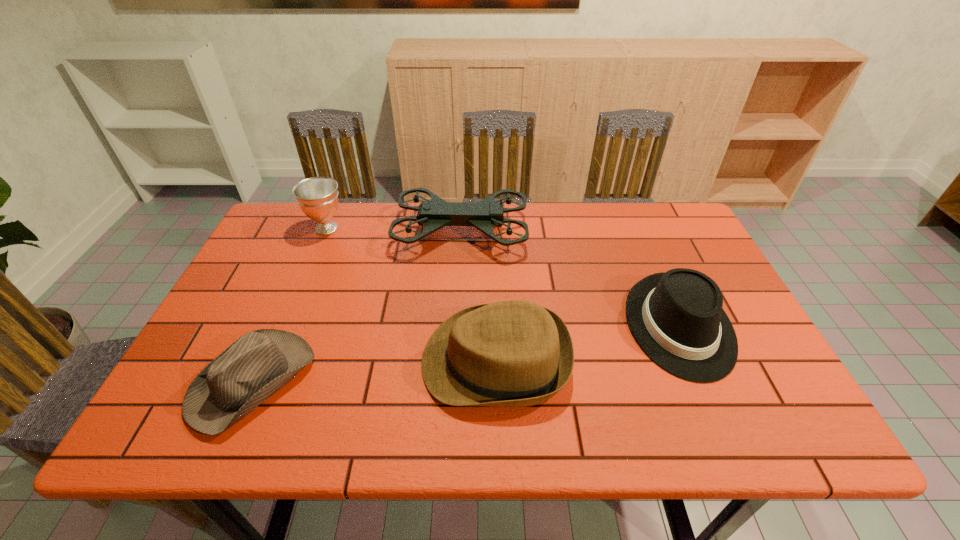
In the image, there is a desktop. Identify the location of blank space at the far edge. (627, 218).

Identify the location of blank space at the near edge of the desktop. This screenshot has height=540, width=960. (703, 410).

At what (x,y) coordinates should I click in order to perform the action: click on vacant space at the left edge of the desktop. Please return your answer as a coordinate pair (x, y). The image size is (960, 540). Looking at the image, I should click on (266, 298).

In the image, there is a desktop. At what (x,y) coordinates should I click in order to perform the action: click on free region at the right edge. Please return your answer as a coordinate pair (x, y). The height and width of the screenshot is (540, 960). Looking at the image, I should click on (732, 384).

Image resolution: width=960 pixels, height=540 pixels. In order to click on free space at the far left corner of the desktop in this screenshot , I will do `click(306, 230)`.

Where is `vacant space at the near left corner of the desktop`? vacant space at the near left corner of the desktop is located at coordinates (176, 402).

In the image, there is a desktop. Identify the location of free space at the near right corner. Image resolution: width=960 pixels, height=540 pixels. (766, 436).

You are a GUI agent. You are given a task and a screenshot of the screen. Output one action in this format:
    pyautogui.click(x=<x>, y=<y>)
    Task: Click on the free space between the second fedora from right to left and the tallest object
    The width and height of the screenshot is (960, 540).
    Given the screenshot: What is the action you would take?
    pyautogui.click(x=478, y=296)

At what (x,y) coordinates should I click in order to perform the action: click on unoccupied area between the drone and the second fedora from left to right. Please return your answer as a coordinate pair (x, y). This screenshot has width=960, height=540. Looking at the image, I should click on (478, 296).

The height and width of the screenshot is (540, 960). In order to click on vacant space in between the second fedora from left to right and the rightmost fedora in this screenshot , I will do `click(588, 343)`.